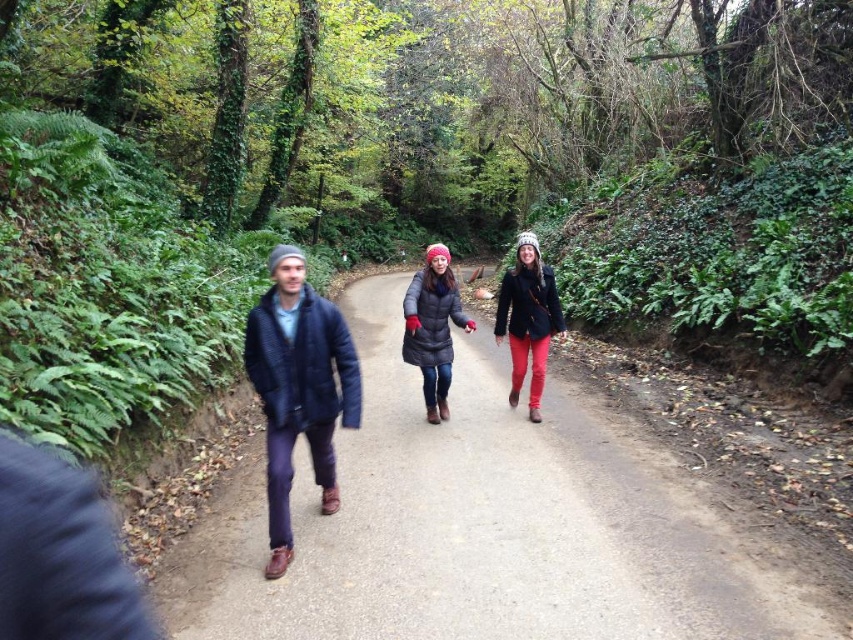
Is smooth concrete path at center smaller than matte black coat at center?

Actually, smooth concrete path at center might be larger than matte black coat at center.

Which is in front, point (560, 608) or point (416, 342)?

Point (560, 608) is in front.

Locate an element on the screen. smooth concrete path at center is located at coordinates (485, 524).

Is smooth concrete path at center smaller than dark blue quilted jacket at center?

No, smooth concrete path at center is not smaller than dark blue quilted jacket at center.

Can you confirm if smooth concrete path at center is positioned above dark blue quilted jacket at center?

No, smooth concrete path at center is not above dark blue quilted jacket at center.

At what (x,y) coordinates should I click in order to perform the action: click on smooth concrete path at center. Please return your answer as a coordinate pair (x, y). Looking at the image, I should click on (485, 524).

Where is `smooth concrete path at center`? The height and width of the screenshot is (640, 853). smooth concrete path at center is located at coordinates (485, 524).

Is matte black jacket at center shorter than matte black coat at center?

No, matte black jacket at center is not shorter than matte black coat at center.

Who is more forward, (521, 300) or (447, 272)?

Positioned in front is point (447, 272).

At what (x,y) coordinates should I click in order to perform the action: click on matte black jacket at center. Please return your answer as a coordinate pair (x, y). This screenshot has width=853, height=640. Looking at the image, I should click on (527, 317).